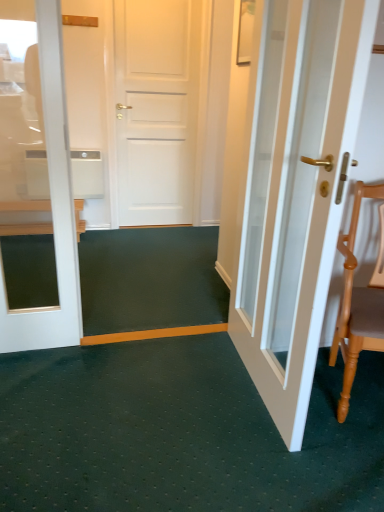
Where is `light brown wooden chair at right`? The width and height of the screenshot is (384, 512). light brown wooden chair at right is located at coordinates (358, 302).

How far apart are white glossy door at right and light brown wooden chair at right?

white glossy door at right is 14.09 inches from light brown wooden chair at right.

Does white glossy door at right appear on the right side of light brown wooden chair at right?

Incorrect, white glossy door at right is not on the right side of light brown wooden chair at right.

Considering the relative sizes of white glossy door at right and light brown wooden chair at right in the image provided, is white glossy door at right shorter than light brown wooden chair at right?

In fact, white glossy door at right may be taller than light brown wooden chair at right.

From the image's perspective, is white glossy door at right on light brown wooden chair at right?

Yes, from the image's perspective, white glossy door at right is above light brown wooden chair at right.

Between wooden chair at left and light brown wooden chair at right, which one has less height?

wooden chair at left.

Between wooden chair at left and light brown wooden chair at right, which one appears on the right side from the viewer's perspective?

light brown wooden chair at right.

Considering the positions of objects wooden chair at left and light brown wooden chair at right in the image provided, who is in front, wooden chair at left or light brown wooden chair at right?

light brown wooden chair at right is in front.

From a real-world perspective, is wooden chair at left over light brown wooden chair at right?

No, from a real-world perspective, wooden chair at left is not above light brown wooden chair at right.

Which object is closer to the camera taking this photo, light brown wooden chair at right or wooden chair at left?

light brown wooden chair at right is more forward.

Is light brown wooden chair at right turned away from wooden chair at left?

No, light brown wooden chair at right is not facing the opposite direction of wooden chair at left.

From the image's perspective, is light brown wooden chair at right on top of wooden chair at left?

No.

From their relative heights in the image, would you say white glossy door at right is taller or shorter than wooden chair at left?

In the image, white glossy door at right appears to be taller than wooden chair at left.

From a real-world perspective, is white glossy door at right under wooden chair at left?

No, from a real-world perspective, white glossy door at right is not below wooden chair at left.

Is white glossy door at right turned away from wooden chair at left?

white glossy door at right is not turned away from wooden chair at left.

Between white glossy door at right and wooden chair at left, which one is positioned behind?

wooden chair at left is more distant.

Measure the distance from light brown wooden chair at right to white glossy door at right.

The distance of light brown wooden chair at right from white glossy door at right is 14.09 inches.

Considering the positions of objects light brown wooden chair at right and white glossy door at right in the image provided, who is more to the left, light brown wooden chair at right or white glossy door at right?

white glossy door at right.

Is point (344, 251) positioned before point (290, 312)?

Yes, point (344, 251) is closer to viewer.

How many degrees apart are the facing directions of light brown wooden chair at right and white glossy door at right?

They differ by 70.1 degrees in their facing directions.

Between point (12, 201) and point (293, 306), which one is positioned behind?

Positioned behind is point (12, 201).

In the scene shown: Is wooden chair at left at the left side of white glossy door at right?

Yes, wooden chair at left is to the left of white glossy door at right.

Considering the relative positions of wooden chair at left and white glossy door at right in the image provided, is wooden chair at left in front of white glossy door at right?

No, wooden chair at left is further to the viewer.

Where is `chair below the white glossy door at right (from the image's perspective)`? The image size is (384, 512). chair below the white glossy door at right (from the image's perspective) is located at coordinates (358, 302).

Identify the location of furniture to the left of light brown wooden chair at right. The image size is (384, 512). (26, 229).

Which object lies nearer to the anchor point wooden chair at left, white glossy door at right or light brown wooden chair at right?

white glossy door at right lies closer to wooden chair at left than the other object.

Based on their spatial positions, is white glossy door at right or wooden chair at left further from light brown wooden chair at right?

wooden chair at left lies further to light brown wooden chair at right than the other object.

Based on their spatial positions, is light brown wooden chair at right or wooden chair at left closer to white glossy door at right?

Among the two, light brown wooden chair at right is located nearer to white glossy door at right.

Based on their spatial positions, is wooden chair at left or light brown wooden chair at right closer to white glossy door at right?

→ light brown wooden chair at right lies closer to white glossy door at right than the other object.

Looking at the image, which one is located further to light brown wooden chair at right, wooden chair at left or white glossy door at right?

The object further to light brown wooden chair at right is wooden chair at left.

From the image, which object appears to be nearer to wooden chair at left, light brown wooden chair at right or white glossy door at right?

white glossy door at right is positioned closer to the anchor wooden chair at left.

Locate an element on the screen. The image size is (384, 512). chair between white glossy door at right and wooden chair at left from front to back is located at coordinates (358, 302).